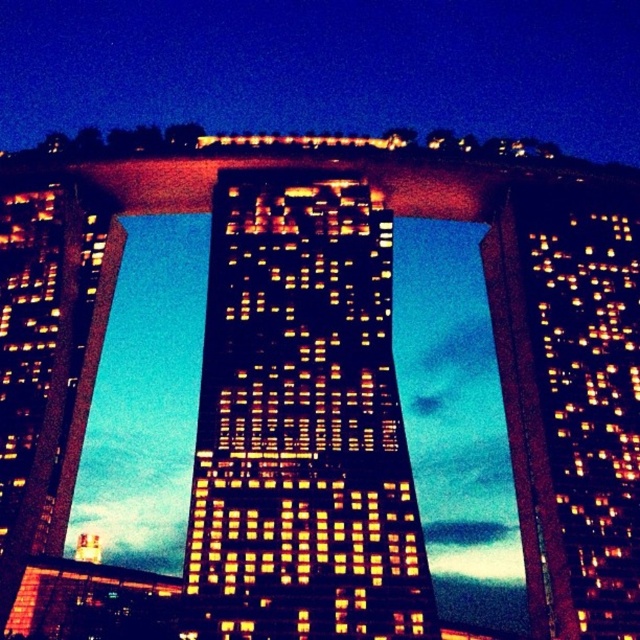
Question: Which object appears closest to the camera in this image?

Choices:
 (A) matte glass skyscraper at center
 (B) matte glass skyscraper at right

Answer: (A)

Question: Is matte glass skyscraper at right further to the viewer compared to matte glass tower at left?

Choices:
 (A) yes
 (B) no

Answer: (A)

Question: Can you confirm if matte glass skyscraper at right is smaller than matte glass tower at left?

Choices:
 (A) no
 (B) yes

Answer: (A)

Question: Which of the following is the farthest from the observer?

Choices:
 (A) matte glass skyscraper at right
 (B) matte glass tower at left
 (C) matte glass skyscraper at center

Answer: (A)

Question: Based on their relative distances, which object is farther from the matte glass skyscraper at right?

Choices:
 (A) matte glass tower at left
 (B) matte glass skyscraper at center

Answer: (A)

Question: Does matte glass skyscraper at right appear on the right side of matte glass tower at left?

Choices:
 (A) yes
 (B) no

Answer: (A)